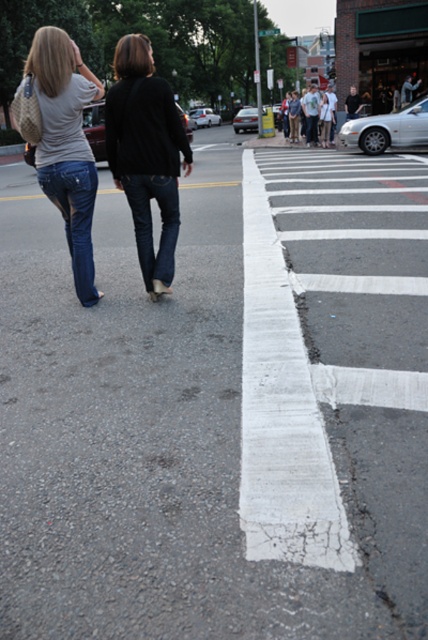
In the scene shown: You are a pedestrian trying to cross the street. You see two people wearing denim jeans at left and denim at center. Which person is closer to the crosswalk?

The denim jeans at left is positioned over denim at center, so the person wearing denim jeans at left is closer to the crosswalk.

You are a pedestrian standing at the crosswalk. You see a black matte sweater at center and denim jeans at left. Which item is closer to the ground?

The black matte sweater at center is located below denim jeans at left, so it is closer to the ground.

You are a pedestrian trying to cross the street. You see two people ahead of you wearing denim jeans at left and denim at center. Which one is closer to the crosswalk?

The denim jeans at left is to the left of denim at center, so the denim jeans at left is closer to the crosswalk.